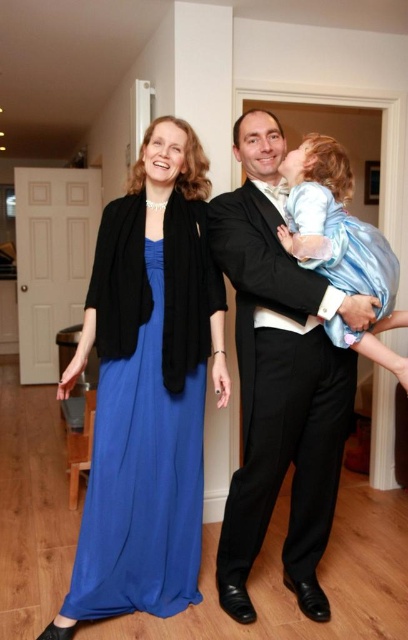
Question: Can you confirm if shiny black suit at center is bigger than silky blue dress at center?

Choices:
 (A) yes
 (B) no

Answer: (A)

Question: Can you confirm if shiny black suit at center is smaller than silky blue dress at center?

Choices:
 (A) no
 (B) yes

Answer: (A)

Question: Which of the following is the farthest from the observer?

Choices:
 (A) (263, 182)
 (B) (115, 262)

Answer: (A)

Question: Which object appears closest to the camera in this image?

Choices:
 (A) shiny black suit at center
 (B) blue silk dress at left
 (C) silky blue dress at center

Answer: (C)

Question: Among these objects, which one is nearest to the camera?

Choices:
 (A) silky blue dress at center
 (B) blue silk dress at left

Answer: (A)

Question: In this image, where is shiny black suit at center located relative to silky blue dress at center?

Choices:
 (A) below
 (B) above

Answer: (A)